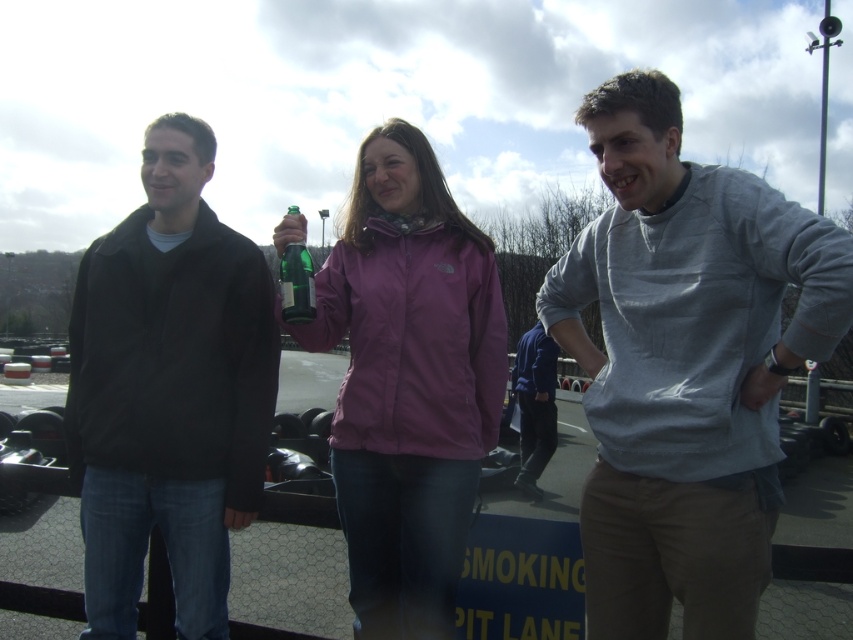
You are a photographer trying to capture a group photo of the gray cotton shirt at center and the blue fleece jacket at center. Since you want to ensure both subjects are clearly visible, which subject should you focus on to account for their size difference?

The gray cotton shirt at center has a larger width than the blue fleece jacket at center, so focusing on the gray cotton shirt at center would ensure both are clearly visible as it takes up more space in the frame.